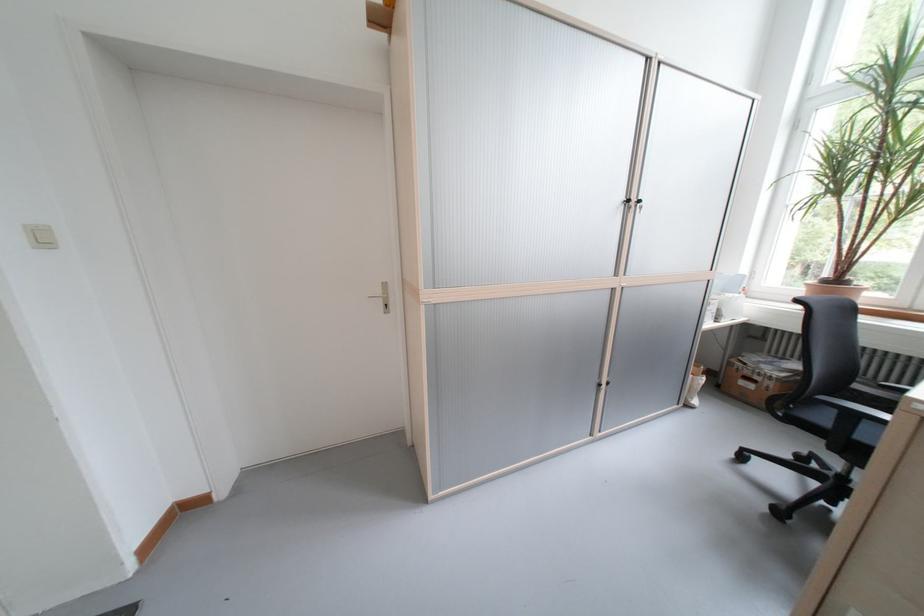
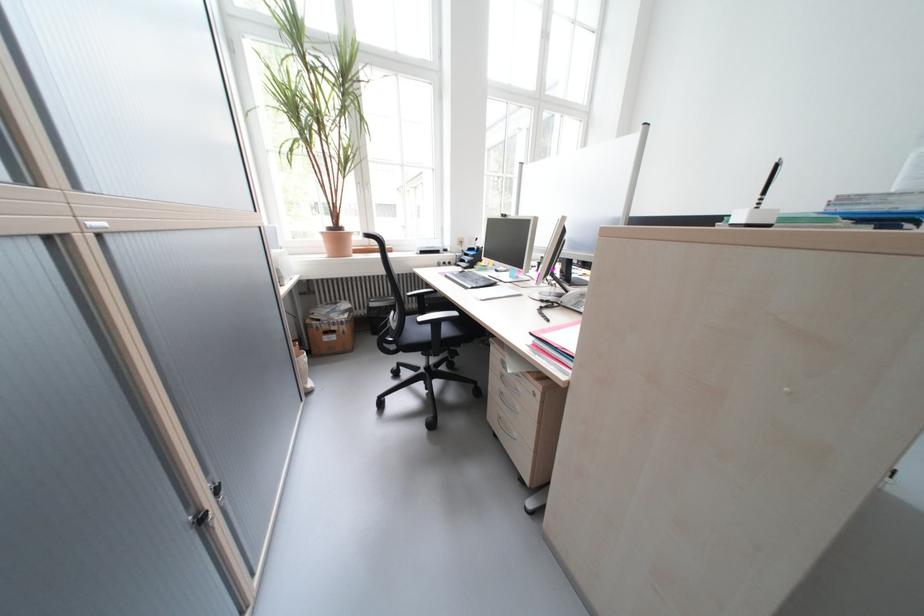
Find the pixel in the second image that matches the point at 610,386 in the first image.

(213, 521)